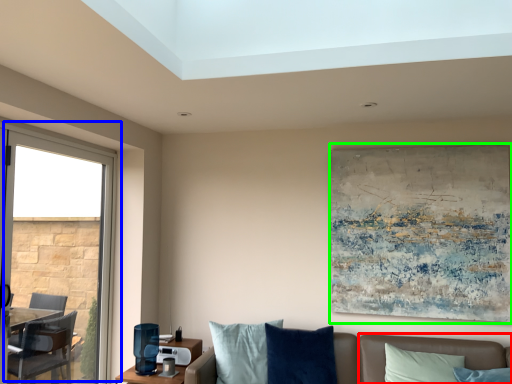
Question: Considering the real-world distances, which object is closest to couch (highlighted by a red box)? window (highlighted by a blue box) or picture frame (highlighted by a green box).

Choices:
 (A) window
 (B) picture frame

Answer: (B)